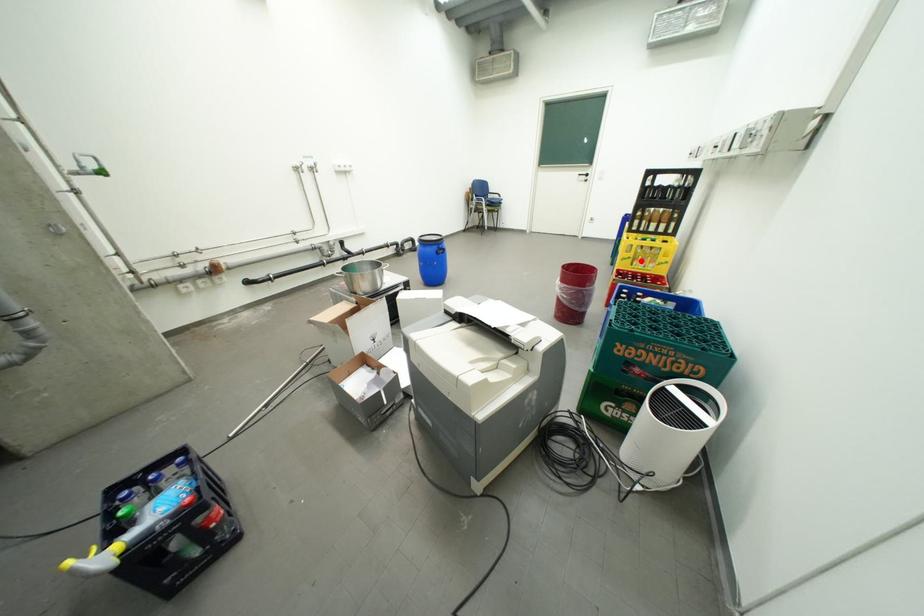
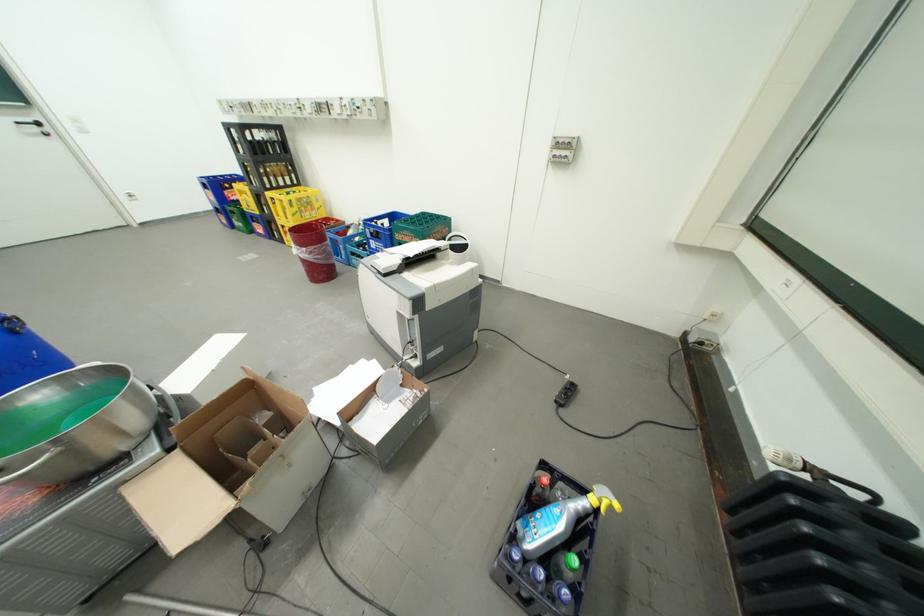
Locate, in the second image, the point that corresponds to the highlighted location in the first image.

(310, 215)